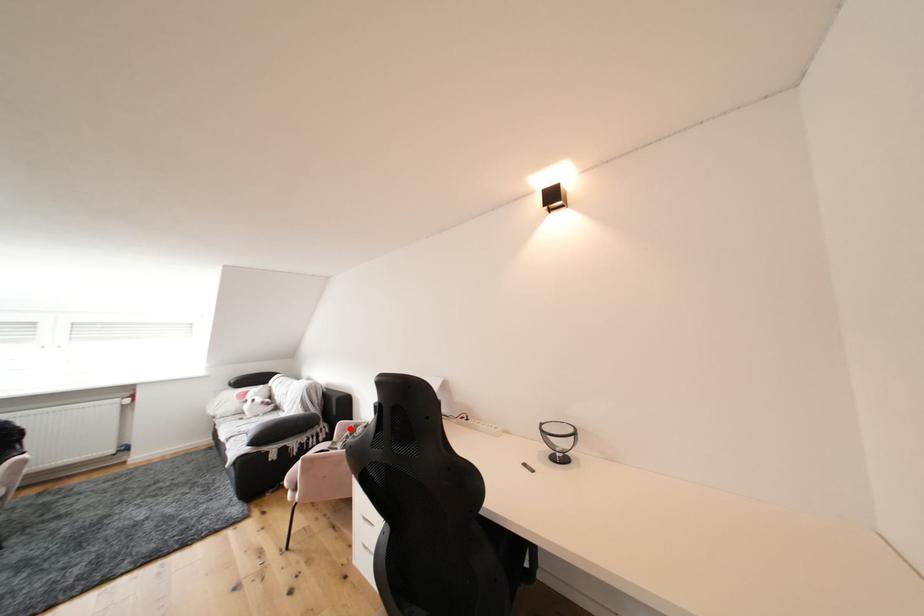
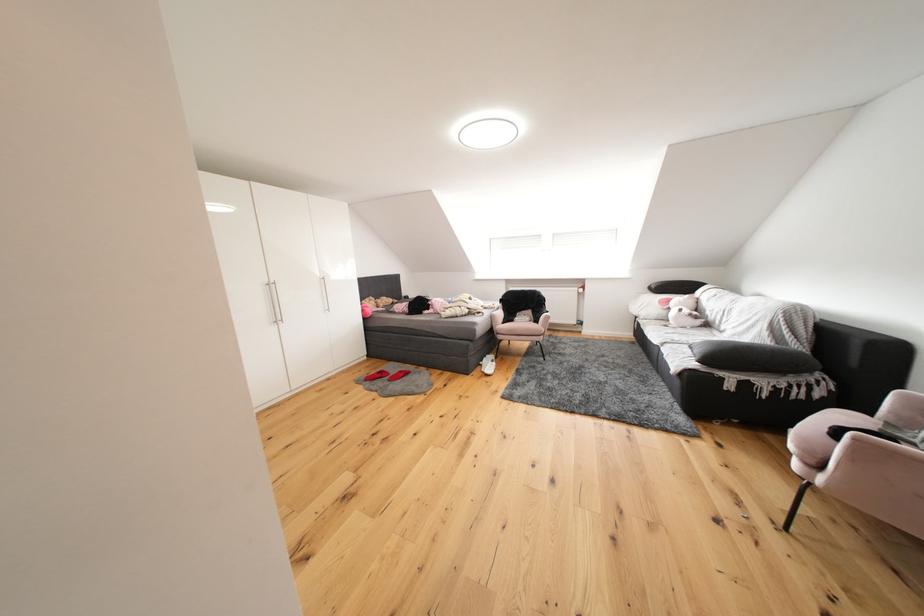
Find the pixel in the second image that matches the highlighted location in the first image.

(916, 400)